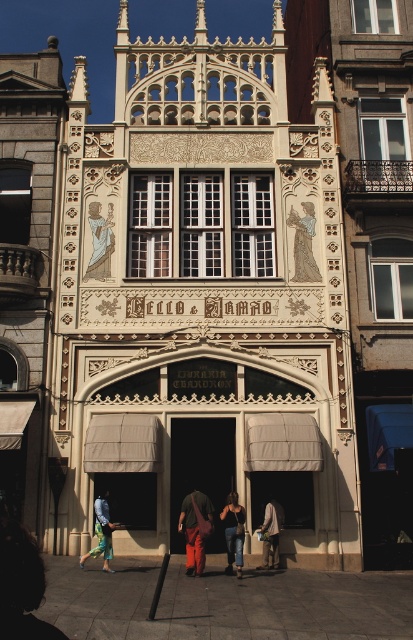
Question: Can you confirm if denim jeans at center is positioned to the left of light beige fabric pants at lower center?

Choices:
 (A) no
 (B) yes

Answer: (B)

Question: Can you confirm if wooden statue at upper left is wider than denim pants at lower center?

Choices:
 (A) yes
 (B) no

Answer: (B)

Question: Which of these objects is positioned closest to the wooden statue at upper left?

Choices:
 (A) matte orange pants at center
 (B) denim jeans at center
 (C) light beige fabric pants at lower center

Answer: (A)

Question: Estimate the real-world distances between objects in this image. Which object is farther from the matte orange pants at center?

Choices:
 (A) wooden statue at upper left
 (B) denim jeans at center
 (C) light beige fabric pants at lower center
 (D) matte gray figure at center

Answer: (A)

Question: Estimate the real-world distances between objects in this image. Which object is farther from the matte gray figure at center?

Choices:
 (A) light beige fabric pants at lower center
 (B) denim jeans at center

Answer: (B)

Question: Where is matte orange pants at center located in relation to light beige fabric pants at lower center in the image?

Choices:
 (A) left
 (B) right

Answer: (A)